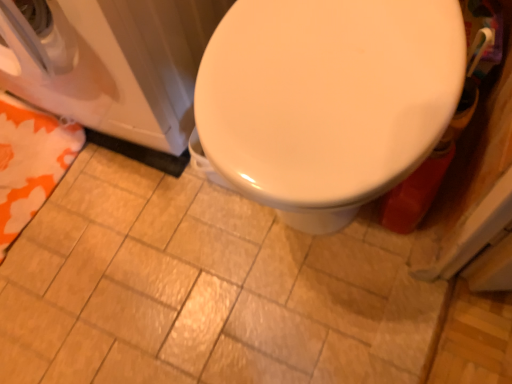
Question: Is there a large distance between white glossy washer at left and orange fabric towel at lower left?

Choices:
 (A) yes
 (B) no

Answer: (B)

Question: Is white glossy washer at left next to orange fabric towel at lower left?

Choices:
 (A) no
 (B) yes

Answer: (A)

Question: Is white glossy washer at left looking in the opposite direction of orange fabric towel at lower left?

Choices:
 (A) no
 (B) yes

Answer: (A)

Question: From a real-world perspective, is white glossy washer at left located beneath orange fabric towel at lower left?

Choices:
 (A) yes
 (B) no

Answer: (B)

Question: From a real-world perspective, is white glossy washer at left positioned over orange fabric towel at lower left based on gravity?

Choices:
 (A) yes
 (B) no

Answer: (A)

Question: From a real-world perspective, is orange fabric towel at lower left physically located above or below matte ceramic tile at center?

Choices:
 (A) below
 (B) above

Answer: (B)

Question: Is orange fabric towel at lower left situated inside matte ceramic tile at center or outside?

Choices:
 (A) inside
 (B) outside

Answer: (A)

Question: In terms of width, does orange fabric towel at lower left look wider or thinner when compared to matte ceramic tile at center?

Choices:
 (A) wide
 (B) thin

Answer: (B)

Question: In the image, is orange fabric towel at lower left positioned in front of or behind matte ceramic tile at center?

Choices:
 (A) behind
 (B) front

Answer: (A)

Question: Relative to orange fabric towel at lower left, is matte ceramic tile at center in front or behind?

Choices:
 (A) front
 (B) behind

Answer: (A)

Question: Is matte ceramic tile at center wider or thinner than orange fabric towel at lower left?

Choices:
 (A) wide
 (B) thin

Answer: (A)

Question: Would you say matte ceramic tile at center is to the left or to the right of orange fabric towel at lower left in the picture?

Choices:
 (A) left
 (B) right

Answer: (B)

Question: Considering the positions of matte ceramic tile at center and orange fabric towel at lower left in the image, is matte ceramic tile at center taller or shorter than orange fabric towel at lower left?

Choices:
 (A) short
 (B) tall

Answer: (A)

Question: Does point (48, 158) appear closer or farther from the camera than point (167, 67)?

Choices:
 (A) closer
 (B) farther

Answer: (B)

Question: Is orange fabric towel at lower left in front of or behind white glossy washer at left in the image?

Choices:
 (A) front
 (B) behind

Answer: (B)